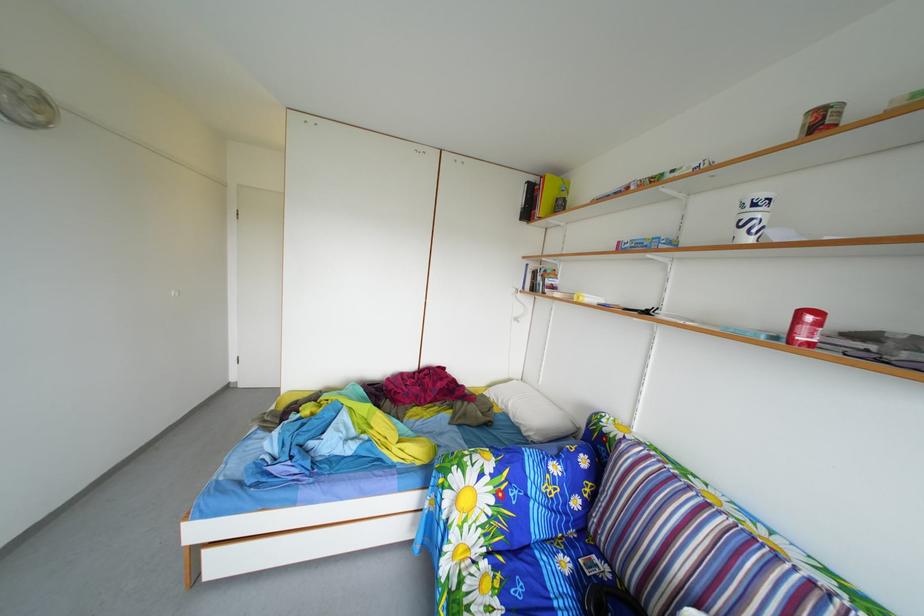
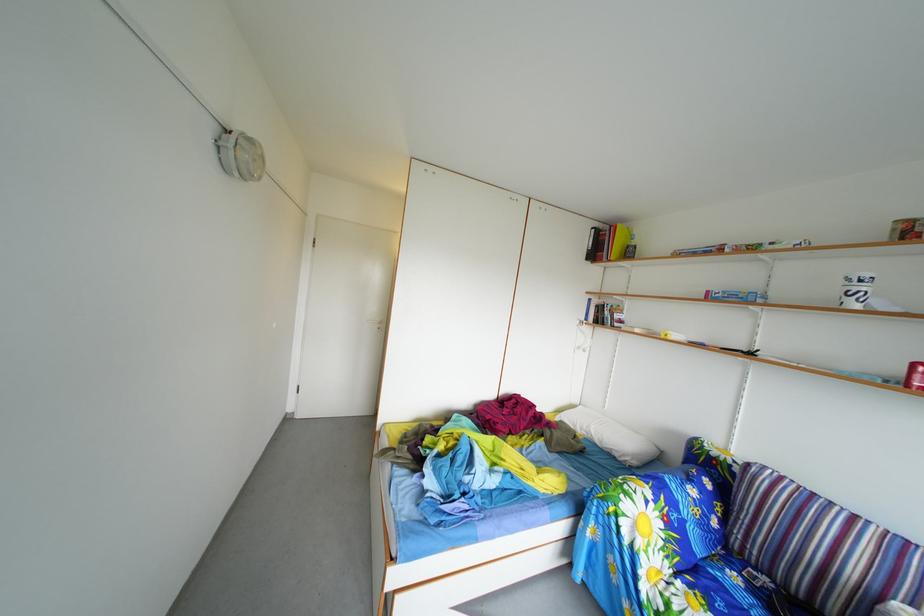
In the second image, find the point that corresponds to point 576,570 in the first image.

(746, 585)